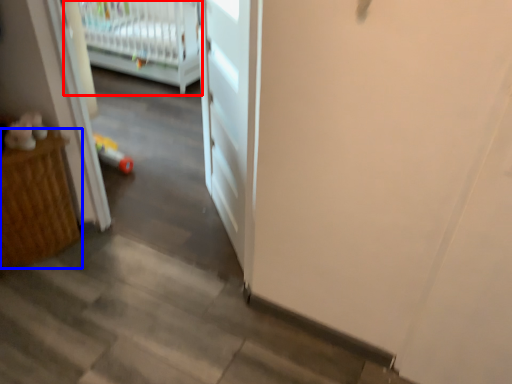
Question: Which object is further to the camera taking this photo, infant bed (highlighted by a red box) or furniture (highlighted by a blue box)?

Choices:
 (A) infant bed
 (B) furniture

Answer: (A)